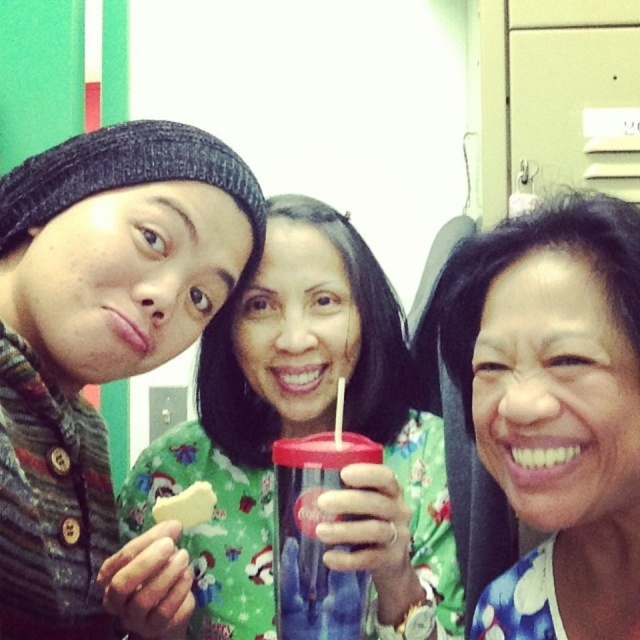
You are trying to find the matte black beanie at upper left and the floral fabric shirt at center in the image. Which one is located more to the left?

The matte black beanie at upper left is more to the left than the floral fabric shirt at center.

You are a photographer trying to capture a group photo of the three people. You notice the matte black beanie at upper left and the translucent plastic cup at center. Which object is taller and might block the view of the other when taking the photo?

The matte black beanie at upper left is much taller than the translucent plastic cup at center, so it might block the view of the cup when taking the photo.